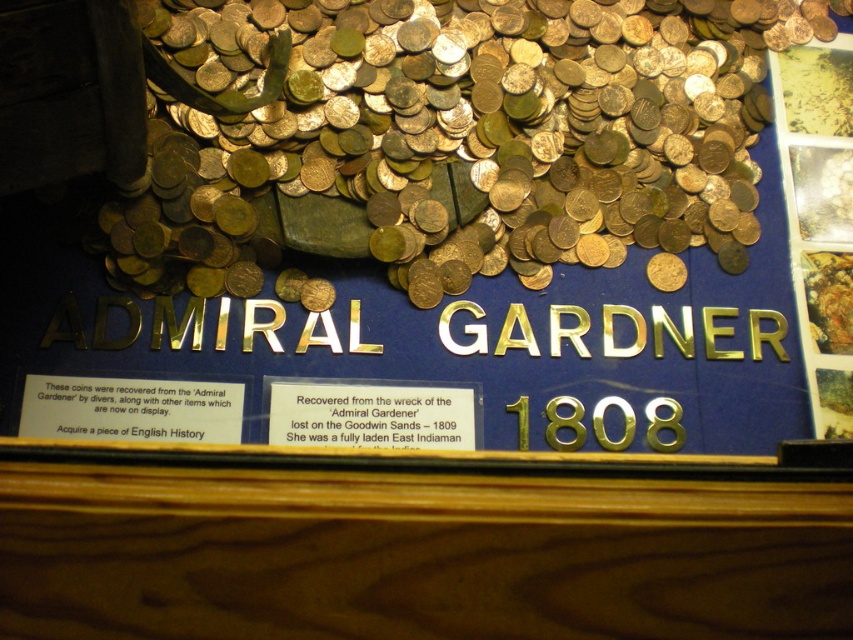
In the scene shown: You are a museum visitor standing in front of the display case. You notice the matte gold plaque at lower left and the gold metallic plaque at center. Which plaque is closer to you?

The matte gold plaque at lower left is closer to you because it is in front of the gold metallic plaque at center.